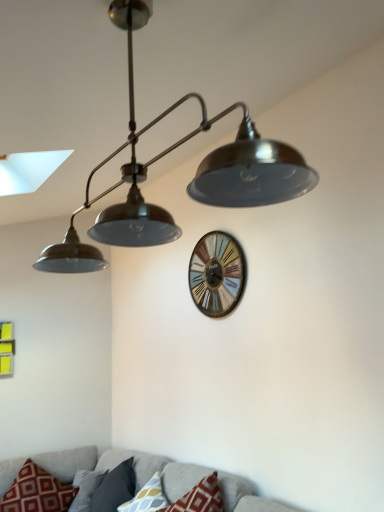
Question: From the image's perspective, is textured gray couch at lower center located beneath wooden wall clock at center?

Choices:
 (A) yes
 (B) no

Answer: (A)

Question: Is textured gray couch at lower center behind wooden wall clock at center?

Choices:
 (A) no
 (B) yes

Answer: (A)

Question: Does textured gray couch at lower center appear on the left side of wooden wall clock at center?

Choices:
 (A) yes
 (B) no

Answer: (A)

Question: From a real-world perspective, does textured gray couch at lower center sit lower than wooden wall clock at center?

Choices:
 (A) no
 (B) yes

Answer: (B)

Question: Considering the relative sizes of textured gray couch at lower center and wooden wall clock at center in the image provided, is textured gray couch at lower center shorter than wooden wall clock at center?

Choices:
 (A) yes
 (B) no

Answer: (B)

Question: Is wooden wall clock at center taller or shorter than red printed cushion at lower left, the third pillow viewed from the right?

Choices:
 (A) tall
 (B) short

Answer: (A)

Question: From the image's perspective, is wooden wall clock at center located above or below red printed cushion at lower left, the third pillow viewed from the right?

Choices:
 (A) above
 (B) below

Answer: (A)

Question: In terms of size, does wooden wall clock at center appear bigger or smaller than red printed cushion at lower left, the third pillow viewed from the right?

Choices:
 (A) big
 (B) small

Answer: (B)

Question: Is wooden wall clock at center inside or outside of red printed cushion at lower left, the third pillow viewed from the right?

Choices:
 (A) inside
 (B) outside

Answer: (B)

Question: Considering their positions, is red printed cushion at lower left, the 1th pillow in the left-to-right sequence, located in front of or behind patterned fabric pillow at lower center, placed as the 3th pillow when sorted from left to right?

Choices:
 (A) front
 (B) behind

Answer: (B)

Question: From the image's perspective, is red printed cushion at lower left, the third pillow viewed from the right, located above or below patterned fabric pillow at lower center, placed as the 1th pillow when sorted from right to left?

Choices:
 (A) below
 (B) above

Answer: (A)

Question: Looking at their shapes, would you say red printed cushion at lower left, the third pillow viewed from the right, is wider or thinner than patterned fabric pillow at lower center, placed as the 3th pillow when sorted from left to right?

Choices:
 (A) thin
 (B) wide

Answer: (B)

Question: Is point (36, 500) closer or farther from the camera than point (132, 503)?

Choices:
 (A) closer
 (B) farther

Answer: (B)

Question: Is point (62, 509) positioned closer to the camera than point (231, 478)?

Choices:
 (A) farther
 (B) closer

Answer: (A)

Question: From their relative heights in the image, would you say red printed cushion at lower left, the third pillow viewed from the right, is taller or shorter than textured gray couch at lower center?

Choices:
 (A) short
 (B) tall

Answer: (A)